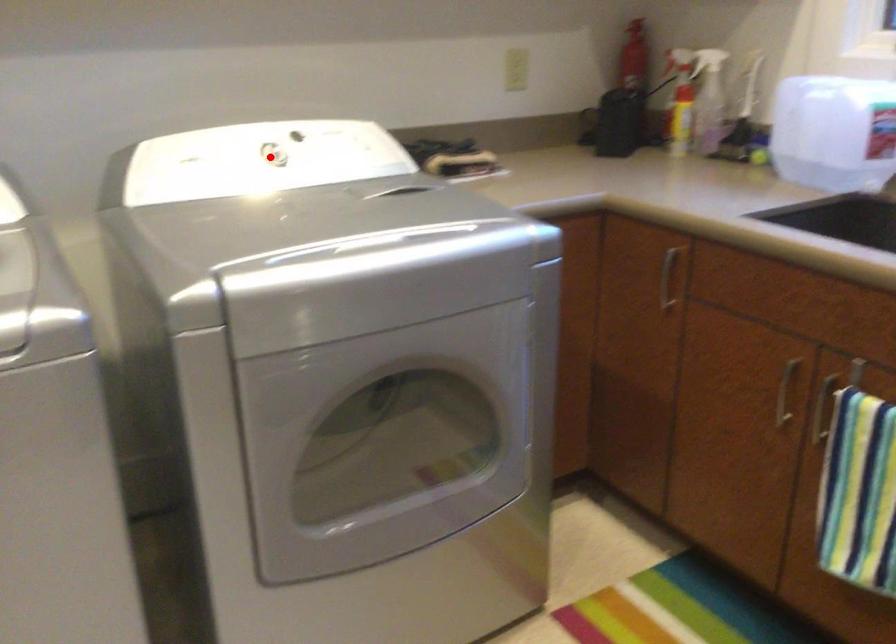
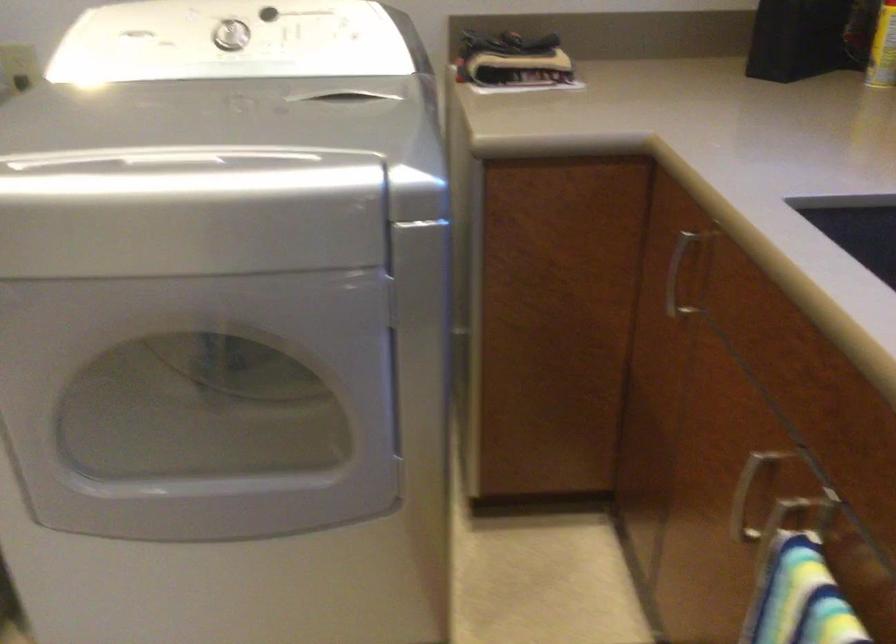
Find the pixel in the second image that matches the highlighted location in the first image.

(229, 35)